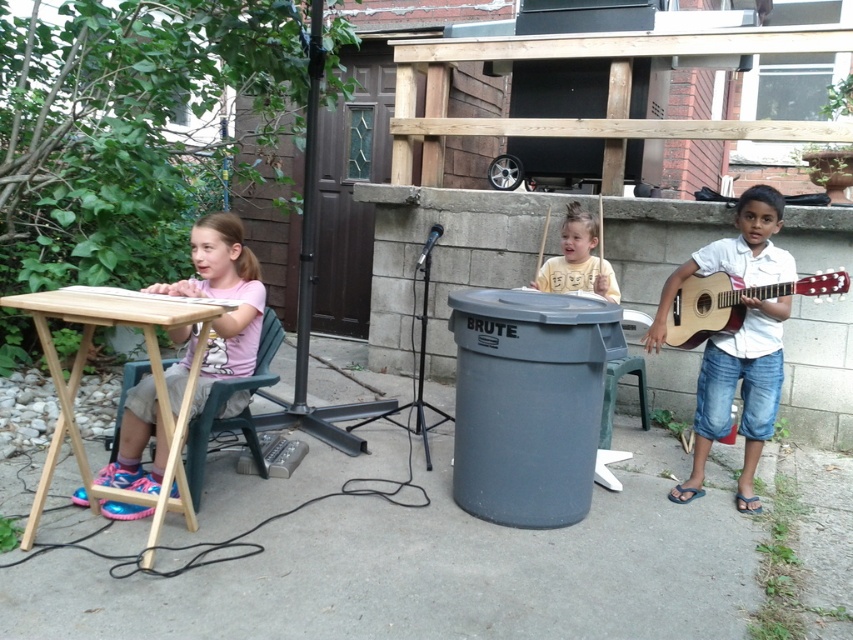
Question: Which of the following is the closest to the observer?

Choices:
 (A) yellow cotton shirt at center
 (B) green plastic chair at left
 (C) white matte shirt at right

Answer: (B)

Question: Can you confirm if yellow cotton shirt at center is wider than green plastic chair at left?

Choices:
 (A) no
 (B) yes

Answer: (B)

Question: Which of the following is the farthest from the observer?

Choices:
 (A) white matte shirt at right
 (B) yellow cotton shirt at center
 (C) green plastic chair at center

Answer: (B)

Question: Can you confirm if green plastic chair at left is positioned below green plastic chair at center?

Choices:
 (A) yes
 (B) no

Answer: (A)

Question: Does white matte shirt at right appear under yellow cotton shirt at center?

Choices:
 (A) no
 (B) yes

Answer: (B)

Question: Which object is farther from the camera taking this photo?

Choices:
 (A) green plastic chair at center
 (B) green plastic chair at left

Answer: (A)